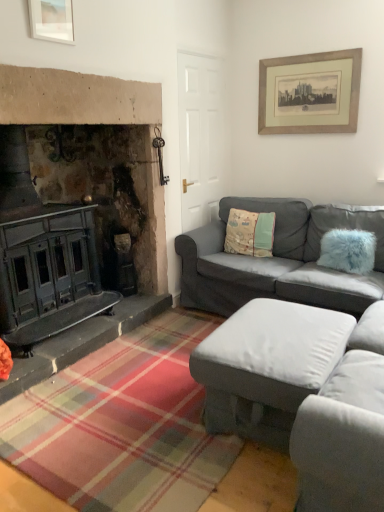
The height and width of the screenshot is (512, 384). In order to click on free point above matte gray ottoman at center, acting as the first studio couch starting from the front (from a real-world perspective) in this screenshot , I will do `click(274, 328)`.